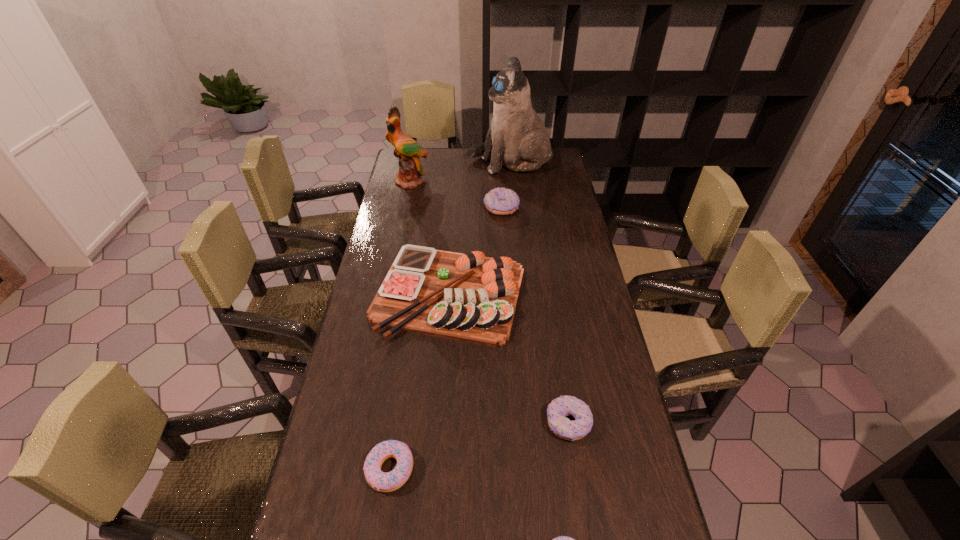
Locate an element on the screen. the tallest object is located at coordinates 517,137.

Identify the location of the second tallest object. The width and height of the screenshot is (960, 540). (408, 151).

Identify the location of parrot. (408, 151).

This screenshot has width=960, height=540. In order to click on platter in this screenshot , I will do `click(468, 297)`.

Locate an element on the screen. This screenshot has height=540, width=960. the fourth farthest object is located at coordinates (468, 297).

Where is `the farthest doughnut`? the farthest doughnut is located at coordinates (500, 201).

You are a GUI agent. You are given a task and a screenshot of the screen. Output one action in this format:
    pyautogui.click(x=<x>, y=<y>)
    Task: Click on the fifth nearest object
    
    Given the screenshot: What is the action you would take?
    pyautogui.click(x=500, y=201)

You are a GUI agent. You are given a task and a screenshot of the screen. Output one action in this format:
    pyautogui.click(x=<x>, y=<y>)
    Task: Click on the right brown doughnut
    The height and width of the screenshot is (540, 960).
    Given the screenshot: What is the action you would take?
    pyautogui.click(x=559, y=408)

The height and width of the screenshot is (540, 960). Find the location of `the smaller brown doughnut`. the smaller brown doughnut is located at coordinates (559, 408).

I want to click on the third farthest doughnut, so click(383, 482).